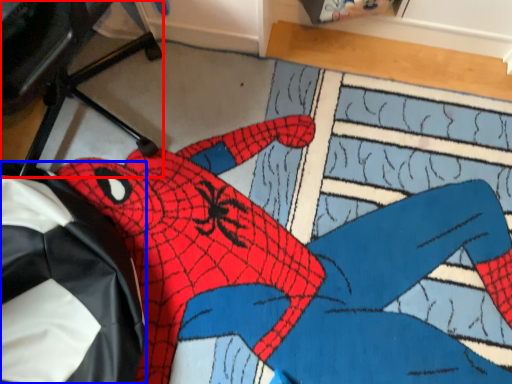
Question: Which object appears closest to the camera in this image, computer chair (highlighted by a red box) or bean bag chair (highlighted by a blue box)?

Choices:
 (A) computer chair
 (B) bean bag chair

Answer: (A)